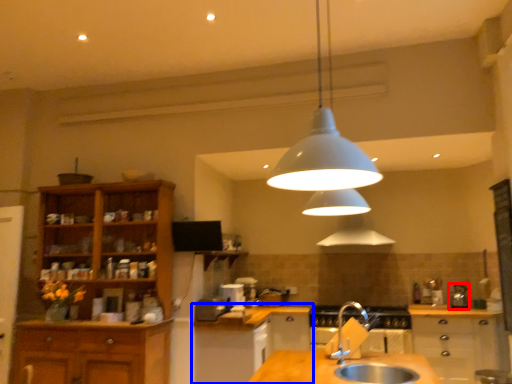
Question: Among these objects, which one is nearest to the camera, appliance (highlighted by a red box) or cabinetry (highlighted by a blue box)?

Choices:
 (A) appliance
 (B) cabinetry

Answer: (B)